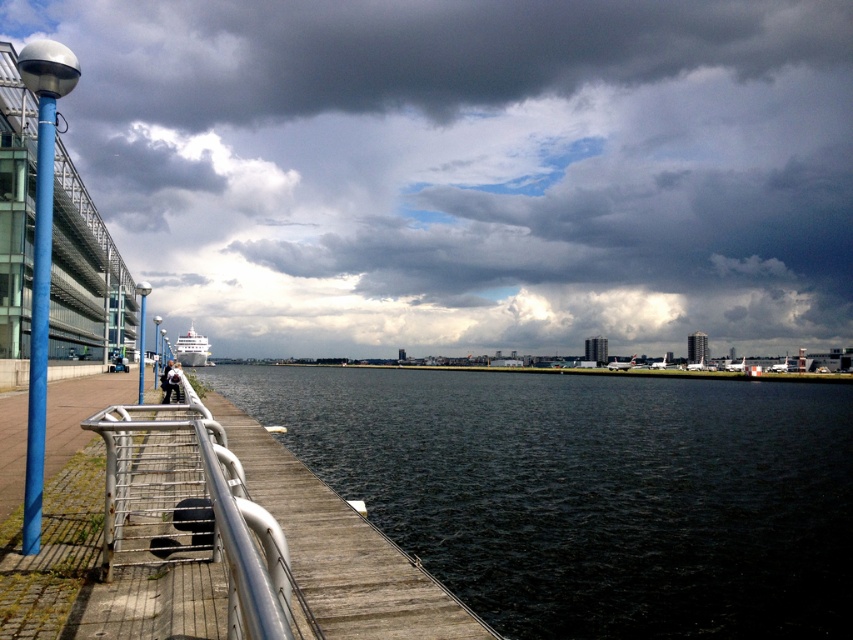
Which of these two, dark gray cloud at upper center or wooden dock at lower left, stands shorter?

wooden dock at lower left is shorter.

Does point (370, 324) lie behind point (368, 616)?

That is True.

Measure the distance between point (x=467, y=67) and camera.

Point (x=467, y=67) and camera are 910.52 feet apart from each other.

This screenshot has width=853, height=640. I want to click on dark gray cloud at upper center, so click(x=469, y=170).

Looking at this image, is the position of dark gray cloud at upper center less distant than that of dark water at center?

That is False.

Which is below, dark gray cloud at upper center or dark water at center?

dark water at center is below.

This screenshot has height=640, width=853. Identify the location of dark gray cloud at upper center. (469, 170).

Identify the location of dark gray cloud at upper center. (469, 170).

Between dark water at center and wooden dock at lower left, which one appears on the left side from the viewer's perspective?

wooden dock at lower left

Does point (740, 417) come closer to viewer compared to point (355, 557)?

No.

The height and width of the screenshot is (640, 853). Identify the location of dark water at center. (590, 492).